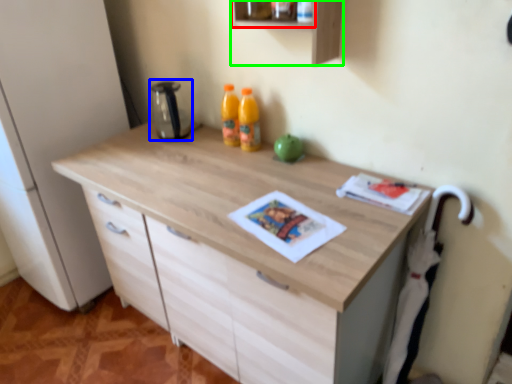
Question: Which is nearer to the shelf (highlighted by a red box)? appliance (highlighted by a blue box) or shelf (highlighted by a green box).

Choices:
 (A) appliance
 (B) shelf

Answer: (B)